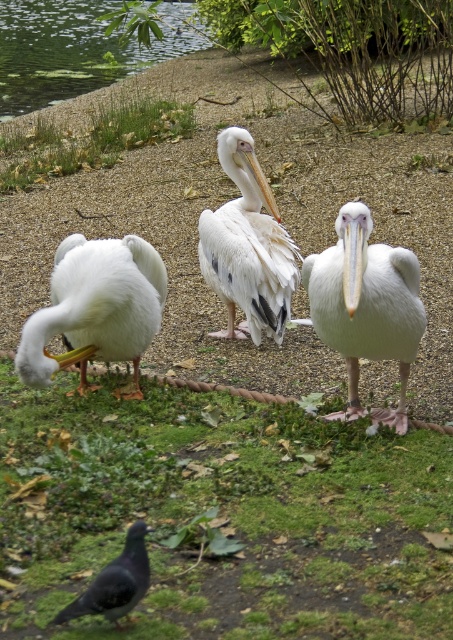
You are standing in the outdoor scene with the three pelicans and a pigeon. You see two points marked in the image. Which point is closer to you, point (x=158, y=132) or point (x=134, y=525)?

Point (x=158, y=132) is further to the viewer than point (x=134, y=525), so point (x=134, y=525) is closer to you.

You are a photographer trying to capture the gray matte pigeon at lower left in your shot. The green grass at upper left is blocking your view. Can you adjust your position to see the pigeon without moving it? Explain why or why not using their sizes.

The green grass at upper left is larger than the gray matte pigeon at lower left. Since the grass is bigger, moving your position might allow you to see around or over it to capture the pigeon without moving the pigeon itself.